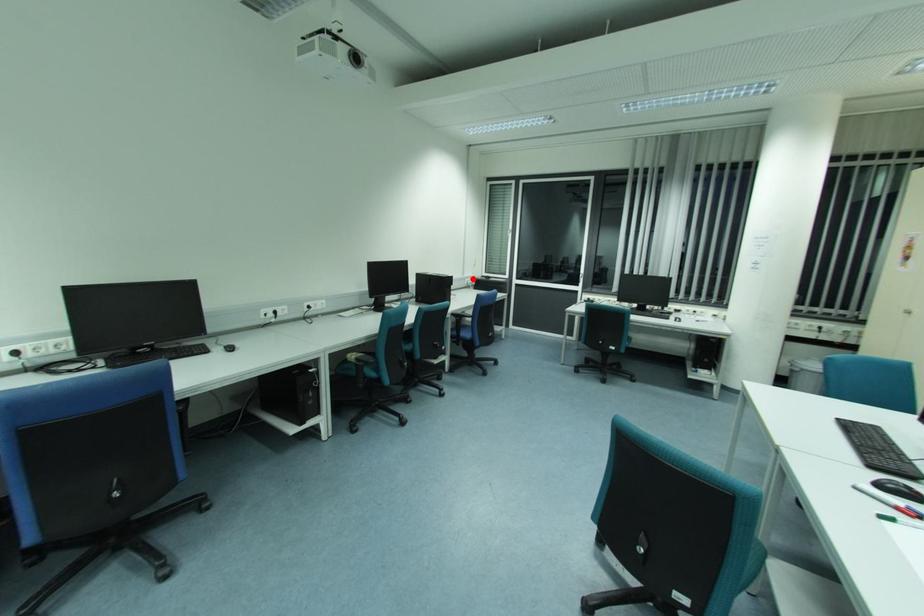
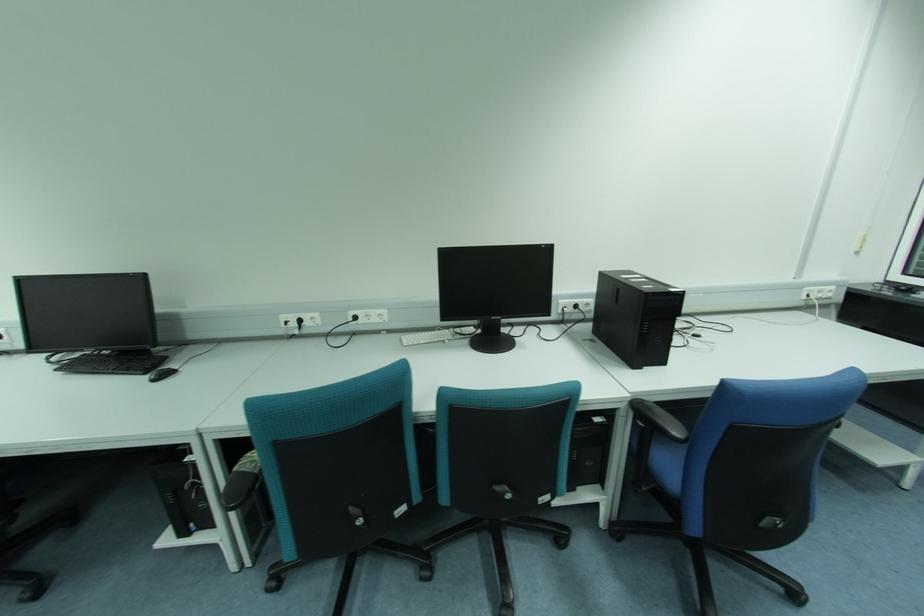
Find the pixel in the second image that matches the highlighted location in the first image.

(833, 288)